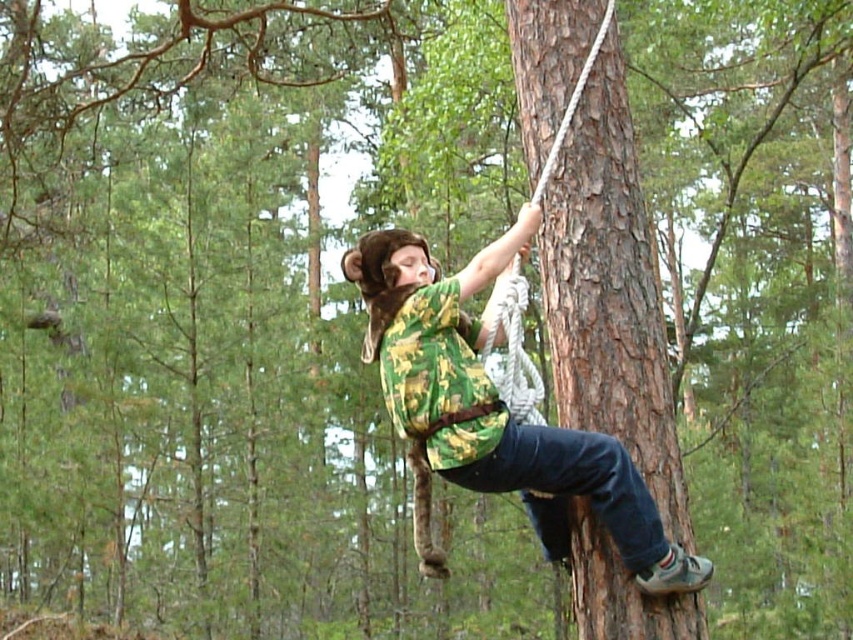
Question: Is brown rough tree trunk at center behind camouflage fabric shirt at center?

Choices:
 (A) yes
 (B) no

Answer: (A)

Question: From the image, what is the correct spatial relationship of brown rough tree trunk at center in relation to camouflage fabric shirt at center?

Choices:
 (A) below
 (B) above

Answer: (B)

Question: Which point is farther from the camera taking this photo?

Choices:
 (A) (621, 396)
 (B) (413, 362)

Answer: (A)

Question: Can you confirm if brown rough tree trunk at center is positioned to the right of camouflage fabric shirt at center?

Choices:
 (A) yes
 (B) no

Answer: (A)

Question: Which of the following is the farthest from the observer?

Choices:
 (A) brown rough tree trunk at center
 (B) camouflage fabric shirt at center

Answer: (A)